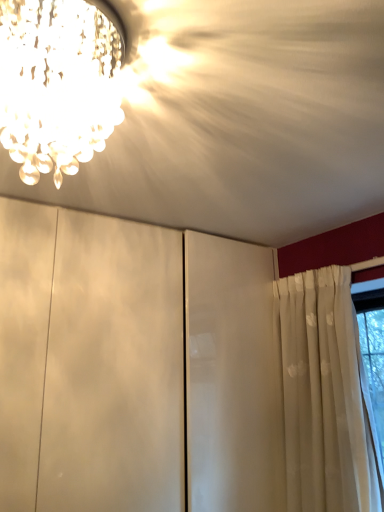
This screenshot has height=512, width=384. I want to click on crystal chandelier at upper left, so click(x=57, y=83).

The image size is (384, 512). What do you see at coordinates (57, 83) in the screenshot?
I see `crystal chandelier at upper left` at bounding box center [57, 83].

Measure the distance between white matte cabinet at center and camera.

A distance of 66.05 centimeters exists between white matte cabinet at center and camera.

You are a GUI agent. You are given a task and a screenshot of the screen. Output one action in this format:
    pyautogui.click(x=<x>, y=<y>)
    Task: Click on the white matte cabinet at center
    
    Given the screenshot: What is the action you would take?
    pyautogui.click(x=240, y=121)

Measure the distance between point (123, 143) and camera.

The distance of point (123, 143) from camera is 3.51 feet.

What do you see at coordinates (240, 121) in the screenshot?
I see `white matte cabinet at center` at bounding box center [240, 121].

Locate an element on the screen. crystal chandelier at upper left is located at coordinates point(57,83).

Based on their positions, is crystal chandelier at upper left located to the left or right of white matte cabinet at center?

crystal chandelier at upper left is to the left of white matte cabinet at center.

Considering the relative positions of crystal chandelier at upper left and white matte cabinet at center in the image provided, is crystal chandelier at upper left in front of white matte cabinet at center?

No, crystal chandelier at upper left is further to the viewer.

Does point (38, 139) appear closer or farther from the camera than point (122, 0)?

Point (38, 139) is farther from the camera than point (122, 0).

From the image's perspective, between crystal chandelier at upper left and white matte cabinet at center, which one is located above?

crystal chandelier at upper left, from the image's perspective.

From a real-world perspective, which is physically below, crystal chandelier at upper left or white matte cabinet at center?

From a 3D spatial view, crystal chandelier at upper left is below.

Between crystal chandelier at upper left and white matte cabinet at center, which one has larger width?

white matte cabinet at center.

Which of these two, crystal chandelier at upper left or white matte cabinet at center, stands shorter?

white matte cabinet at center.

Does crystal chandelier at upper left have a larger size compared to white matte cabinet at center?

No.

Would you say crystal chandelier at upper left is inside or outside white matte cabinet at center?

crystal chandelier at upper left is outside white matte cabinet at center.

Is crystal chandelier at upper left next to white matte cabinet at center and touching it?

No, crystal chandelier at upper left is not beside white matte cabinet at center.

Does crystal chandelier at upper left turn towards white matte cabinet at center?

No, crystal chandelier at upper left is not turned towards white matte cabinet at center.

How different are the orientations of crystal chandelier at upper left and white matte cabinet at center in degrees?

There is a 176-degree angle between the facing directions of crystal chandelier at upper left and white matte cabinet at center.

At what (x,y) coordinates should I click in order to perform the action: click on lamp on the left of white matte cabinet at center. Please return your answer as a coordinate pair (x, y). The width and height of the screenshot is (384, 512). Looking at the image, I should click on (57, 83).

Is white matte cabinet at center at the left side of crystal chandelier at upper left?

No, white matte cabinet at center is not to the left of crystal chandelier at upper left.

Which is behind, white matte cabinet at center or crystal chandelier at upper left?

crystal chandelier at upper left is behind.

Considering the positions of points (348, 75) and (30, 88), is point (348, 75) closer to camera compared to point (30, 88)?

No, (348, 75) is behind (30, 88).

From the image's perspective, which one is positioned lower, white matte cabinet at center or crystal chandelier at upper left?

white matte cabinet at center is shown below in the image.

From a real-world perspective, is white matte cabinet at center positioned under crystal chandelier at upper left based on gravity?

No, from a real-world perspective, white matte cabinet at center is not under crystal chandelier at upper left.

Considering the sizes of objects white matte cabinet at center and crystal chandelier at upper left in the image provided, who is thinner, white matte cabinet at center or crystal chandelier at upper left?

Thinner between the two is crystal chandelier at upper left.

From the picture: Is white matte cabinet at center shorter than crystal chandelier at upper left?

Indeed, white matte cabinet at center has a lesser height compared to crystal chandelier at upper left.

Is white matte cabinet at center bigger or smaller than crystal chandelier at upper left?

white matte cabinet at center is bigger than crystal chandelier at upper left.

Would you say crystal chandelier at upper left is part of white matte cabinet at center's contents?

No, crystal chandelier at upper left is not a part of white matte cabinet at center.

Is white matte cabinet at center placed right next to crystal chandelier at upper left?

No.

Is white matte cabinet at center positioned with its back to crystal chandelier at upper left?

No, white matte cabinet at center is not facing the opposite direction of crystal chandelier at upper left.

What's the angular difference between white matte cabinet at center and crystal chandelier at upper left's facing directions?

There is a 176-degree angle between the facing directions of white matte cabinet at center and crystal chandelier at upper left.

There is a crystal chandelier at upper left. Identify the location of cloud above it (from a real-world perspective). (240, 121).

Find the location of a particular element. The image size is (384, 512). cloud that appears below the crystal chandelier at upper left (from the image's perspective) is located at coordinates (240, 121).

This screenshot has width=384, height=512. I want to click on cloud that is above the crystal chandelier at upper left (from a real-world perspective), so click(x=240, y=121).